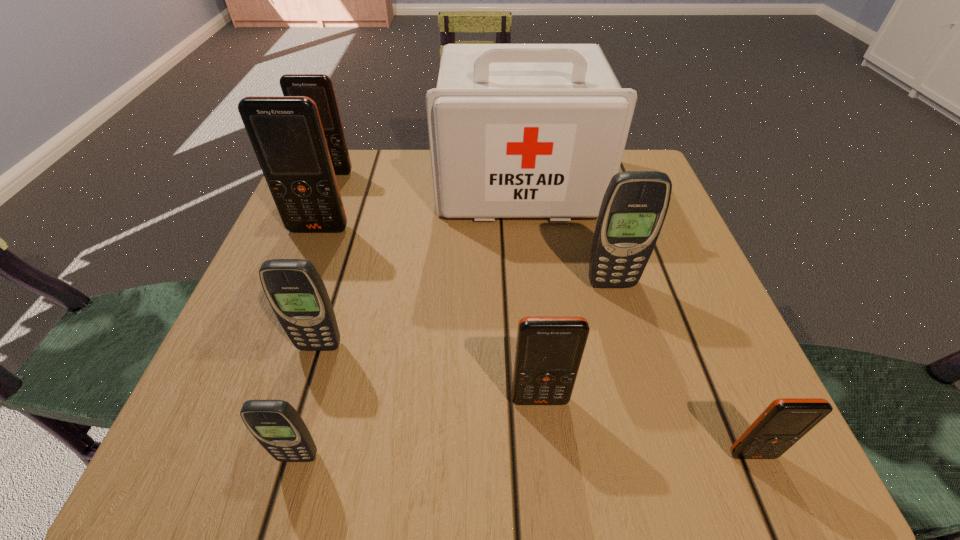
Identify which cellular telephone is the third nearest to the sixth farthest object. Please provide its 2D coordinates. Your answer should be formatted as a tuple, i.e. [(x, y)], where the tuple contains the x and y coordinates of a point satisfying the conditions above.

[(277, 426)]

Identify which cellular telephone is the fifth nearest to the smallest orange cellular telephone. Please provide its 2D coordinates. Your answer should be formatted as a tuple, i.e. [(x, y)], where the tuple contains the x and y coordinates of a point satisfying the conditions above.

[(286, 132)]

The width and height of the screenshot is (960, 540). In order to click on the closest orange cellular telephone to the second biggest gray cellular telephone in this screenshot , I will do `click(286, 132)`.

Identify which orange cellular telephone is the nearest to the first-aid kit. Please provide its 2D coordinates. Your answer should be formatted as a tuple, i.e. [(x, y)], where the tuple contains the x and y coordinates of a point satisfying the conditions above.

[(286, 132)]

Identify which gray cellular telephone is the closest to the fifth nearest object. Please provide its 2D coordinates. Your answer should be formatted as a tuple, i.e. [(x, y)], where the tuple contains the x and y coordinates of a point satisfying the conditions above.

[(294, 288)]

At what (x,y) coordinates should I click in order to perform the action: click on the second closest gray cellular telephone to the second nearest gray cellular telephone. Please return your answer as a coordinate pair (x, y). Looking at the image, I should click on (635, 204).